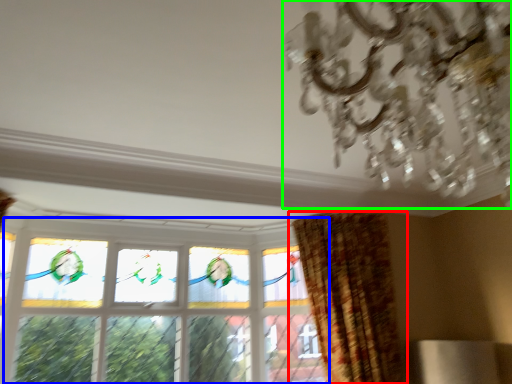
Question: Which object is positioned farthest from curtain (highlighted by a red box)? Select from window (highlighted by a blue box) and chandelier (highlighted by a green box).

Choices:
 (A) window
 (B) chandelier

Answer: (B)